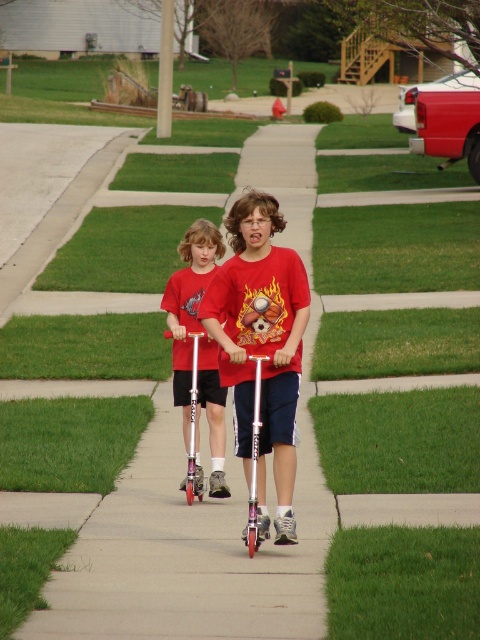
Question: Is smooth concrete sidewalk at center below matte red scooter at center?

Choices:
 (A) yes
 (B) no

Answer: (B)

Question: In this image, where is matte red t-shirt at center located relative to matte red scooter at center?

Choices:
 (A) left
 (B) right

Answer: (B)

Question: Which of the following is the farthest from the observer?

Choices:
 (A) (283, 124)
 (B) (184, 355)
 (C) (277, 301)

Answer: (A)

Question: Which is farther from the smooth concrete sidewalk at center?

Choices:
 (A) matte red scooter at center
 (B) matte red t-shirt at center

Answer: (A)

Question: Can you confirm if smooth concrete sidewalk at center is positioned to the right of matte red t-shirt at center?

Choices:
 (A) no
 (B) yes

Answer: (B)

Question: Which object appears closest to the camera in this image?

Choices:
 (A) matte red scooter at center
 (B) matte red t-shirt at center
 (C) smooth concrete sidewalk at center

Answer: (C)